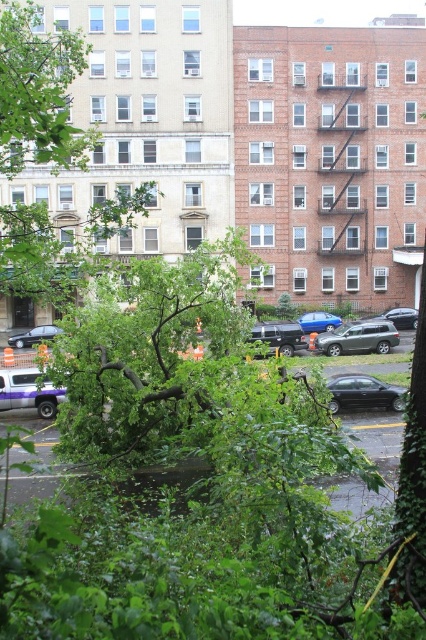
Who is more forward, (46, 397) or (368, 323)?

Point (46, 397) is in front.

The image size is (426, 640). Describe the element at coordinates (28, 392) in the screenshot. I see `purple matte truck at lower left` at that location.

Identify the location of purple matte truck at lower left. The height and width of the screenshot is (640, 426). (28, 392).

Which is more to the right, purple matte truck at lower left or metallic silver suv at center?

Positioned to the right is metallic silver suv at center.

Does purple matte truck at lower left appear over metallic silver suv at center?

Actually, purple matte truck at lower left is below metallic silver suv at center.

You are a GUI agent. You are given a task and a screenshot of the screen. Output one action in this format:
    pyautogui.click(x=<x>, y=<y>)
    Task: Click on the purple matte truck at lower left
    
    Given the screenshot: What is the action you would take?
    pyautogui.click(x=28, y=392)

Between point (39, 268) and point (383, 397), which one is positioned behind?

Point (383, 397)

Does point (26, 80) come behind point (399, 394)?

No, it is not.

Which is in front, point (80, 241) or point (394, 401)?

Point (394, 401) is more forward.

You are a GUI agent. You are given a task and a screenshot of the screen. Output one action in this format:
    pyautogui.click(x=<x>, y=<y>)
    Task: Click on the green leafy tree at upper left
    
    Given the screenshot: What is the action you would take?
    pyautogui.click(x=40, y=92)